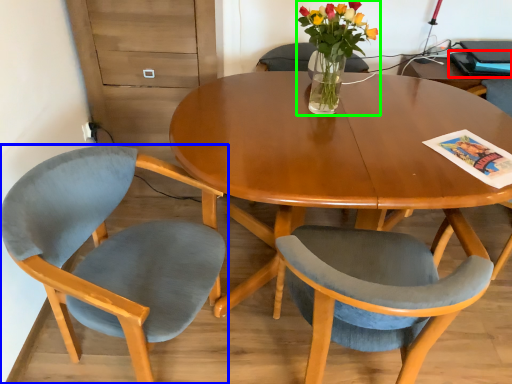
Question: Estimate the real-world distances between objects in this image. Which object is closer to magazine (highlighted by a red box), chair (highlighted by a blue box) or houseplant (highlighted by a green box)?

Choices:
 (A) chair
 (B) houseplant

Answer: (B)